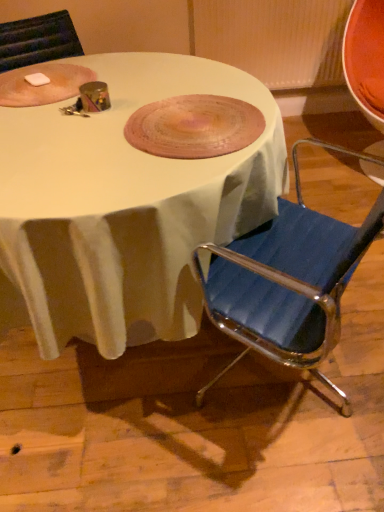
Question: Should I look upward or downward to see white glossy table at center?

Choices:
 (A) down
 (B) up

Answer: (B)